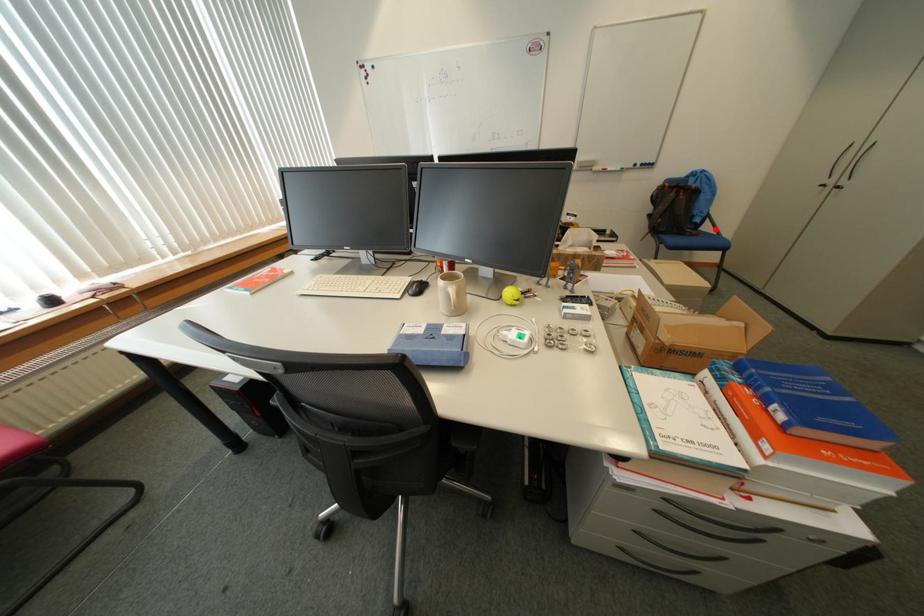
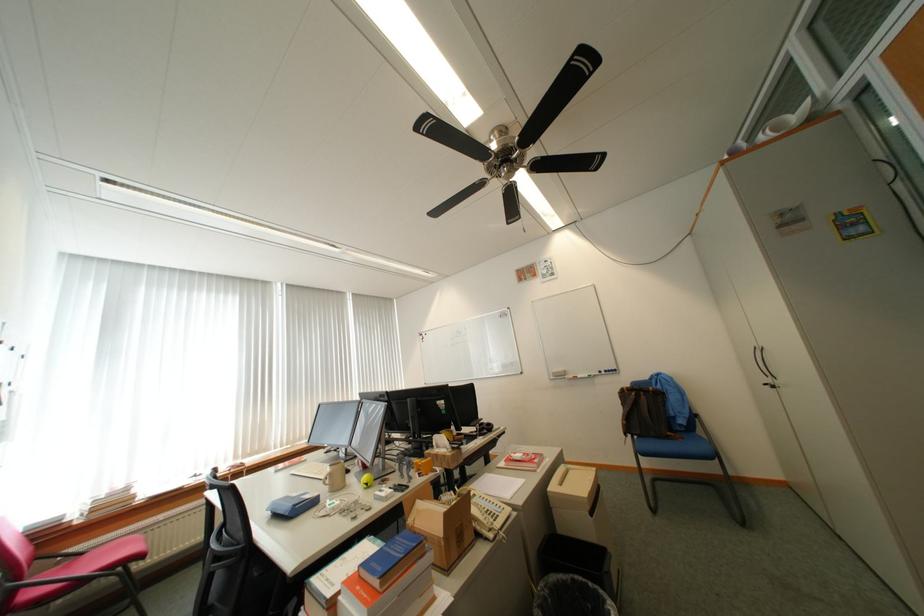
Find the pixel in the second image that matches the highlighted location in the first image.

(709, 432)